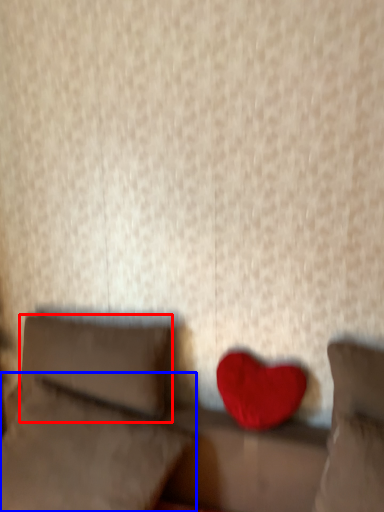
Question: Among these objects, which one is nearest to the camera, pillow (highlighted by a red box) or pillow (highlighted by a blue box)?

Choices:
 (A) pillow
 (B) pillow

Answer: (B)